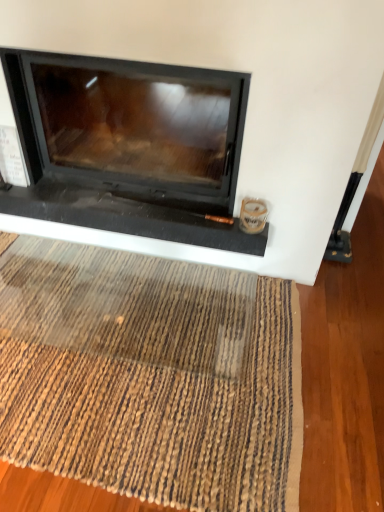
Question: Is black glass fireplace at center positioned far away from brown woven mat at lower center?

Choices:
 (A) yes
 (B) no

Answer: (B)

Question: Does black glass fireplace at center turn towards brown woven mat at lower center?

Choices:
 (A) no
 (B) yes

Answer: (B)

Question: From a real-world perspective, is black glass fireplace at center positioned over brown woven mat at lower center based on gravity?

Choices:
 (A) yes
 (B) no

Answer: (A)

Question: Can you confirm if black glass fireplace at center is wider than brown woven mat at lower center?

Choices:
 (A) yes
 (B) no

Answer: (B)

Question: From a real-world perspective, is black glass fireplace at center below brown woven mat at lower center?

Choices:
 (A) no
 (B) yes

Answer: (A)

Question: Is black glass fireplace at center located outside brown woven mat at lower center?

Choices:
 (A) no
 (B) yes

Answer: (B)

Question: From the image's perspective, is brown woven mat at lower center on top of black glass fireplace at center?

Choices:
 (A) no
 (B) yes

Answer: (A)

Question: From a real-world perspective, does brown woven mat at lower center sit lower than black glass fireplace at center?

Choices:
 (A) no
 (B) yes

Answer: (B)

Question: From the image's perspective, is brown woven mat at lower center below black glass fireplace at center?

Choices:
 (A) yes
 (B) no

Answer: (A)

Question: Is brown woven mat at lower center directly adjacent to black glass fireplace at center?

Choices:
 (A) no
 (B) yes

Answer: (A)

Question: From a real-world perspective, is brown woven mat at lower center positioned over black glass fireplace at center based on gravity?

Choices:
 (A) yes
 (B) no

Answer: (B)

Question: Does brown woven mat at lower center lie behind black glass fireplace at center?

Choices:
 (A) no
 (B) yes

Answer: (A)

Question: Is brown woven mat at lower center situated inside black glass fireplace at center or outside?

Choices:
 (A) outside
 (B) inside

Answer: (A)